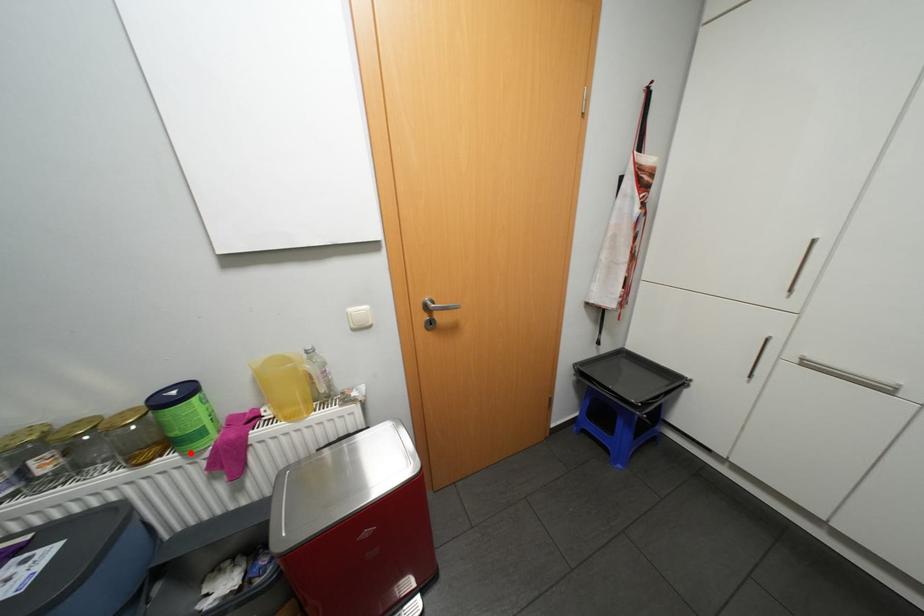
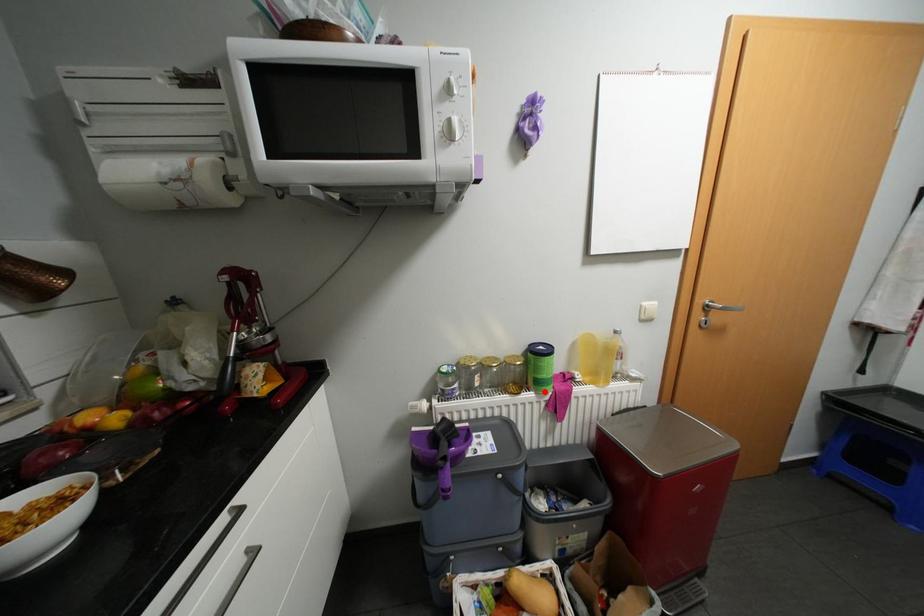
I am providing you with two images of the same scene from different viewpoints. A red point is marked on the first image and another point is marked on the second image. Is the marked point in image1 the same physical position as the marked point in image2?

Yes